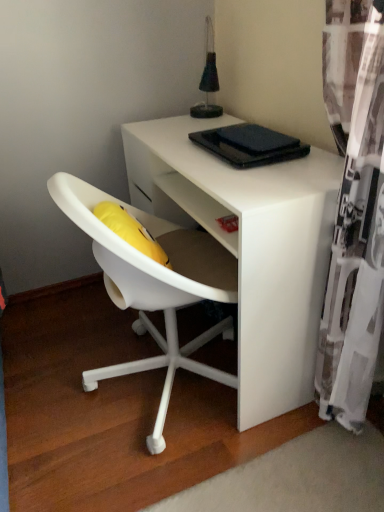
The width and height of the screenshot is (384, 512). I want to click on free point above black matte pad at upper center (from a real-world perspective), so click(x=255, y=133).